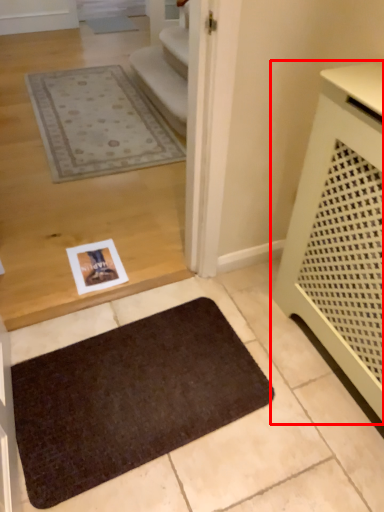
Question: From the image's perspective, where is furniture (annotated by the red box) located in relation to mat in the image?

Choices:
 (A) above
 (B) below

Answer: (A)